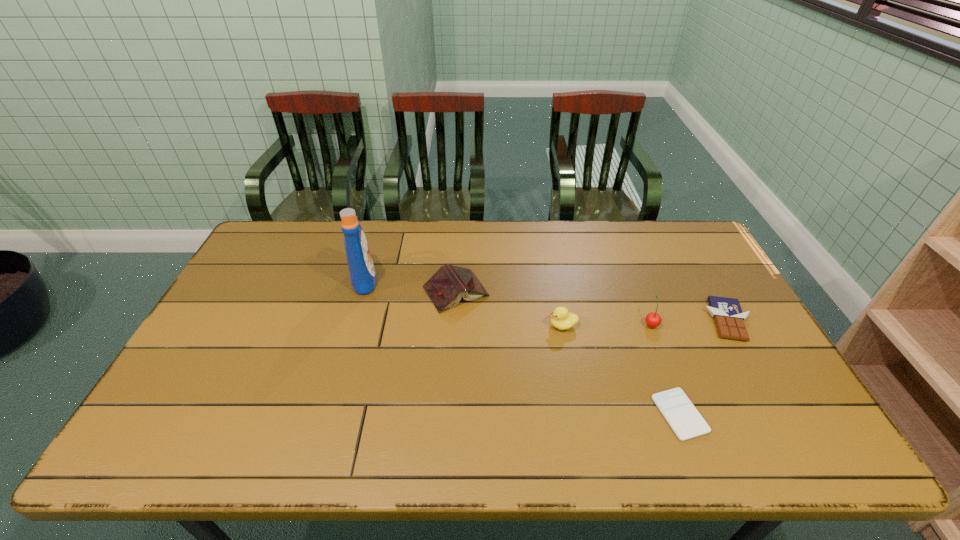
In the image, there is a desktop. Where is `free region at the far edge`? The image size is (960, 540). free region at the far edge is located at coordinates (325, 259).

Identify the location of vacant space at the near edge of the desktop. (724, 447).

Image resolution: width=960 pixels, height=540 pixels. I want to click on free region at the left edge of the desktop, so click(233, 324).

This screenshot has width=960, height=540. I want to click on free space at the right edge of the desktop, so click(741, 388).

You are a GUI agent. You are given a task and a screenshot of the screen. Output one action in this format:
    pyautogui.click(x=<x>, y=<y>)
    Task: Click on the free space at the far right corner of the desktop
    The height and width of the screenshot is (540, 960).
    Given the screenshot: What is the action you would take?
    pyautogui.click(x=670, y=235)

This screenshot has height=540, width=960. In order to click on free area in between the book and the tallest object in this screenshot , I will do [410, 285].

You are a GUI agent. You are given a task and a screenshot of the screen. Output one action in this format:
    pyautogui.click(x=<x>, y=<y>)
    Task: Click on the free spot between the detergent and the shortest object
    This screenshot has height=540, width=960.
    Given the screenshot: What is the action you would take?
    pyautogui.click(x=522, y=347)

Identify the location of free space between the chocolate bar and the cherry. (689, 322).

Identify the location of empty space between the duckling and the fifth shortest object. (607, 325).

Image resolution: width=960 pixels, height=540 pixels. Find the location of `free space between the shortest object and the duckling`. free space between the shortest object and the duckling is located at coordinates (621, 370).